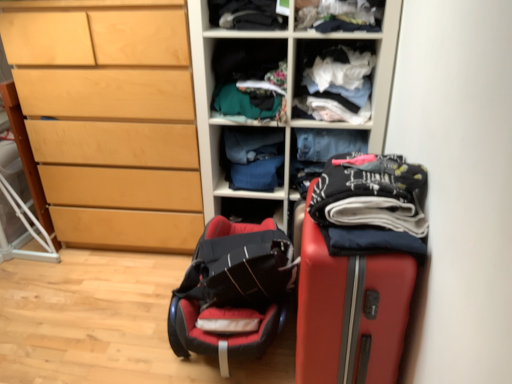
What do you see at coordinates (350, 312) in the screenshot? I see `rubberized red suitcase at right` at bounding box center [350, 312].

Where is `rubberized red suitcase at right`? The width and height of the screenshot is (512, 384). rubberized red suitcase at right is located at coordinates (350, 312).

Where is `printed cotton pants at right, the 5th clothing from the back`? Image resolution: width=512 pixels, height=384 pixels. printed cotton pants at right, the 5th clothing from the back is located at coordinates (369, 205).

Where is `wooden shelves at center`? The width and height of the screenshot is (512, 384). wooden shelves at center is located at coordinates (293, 89).

Identify the location of white cotton shirt at upper center, which is counted as the fourth clothing, starting from the back. (337, 15).

What do you see at coordinates (337, 81) in the screenshot? I see `white fabric at upper center, positioned as the first shelf in right-to-left order` at bounding box center [337, 81].

Identify the location of rubberized red suitcase at right. This screenshot has height=384, width=512. pos(350,312).

Is printed cotton pants at right, the 5th clothing from the back, positioned with its back to white fabric at upper center, positioned as the first shelf in right-to-left order?

No, white fabric at upper center, positioned as the first shelf in right-to-left order, is not at the back of printed cotton pants at right, the 5th clothing from the back.

Considering the relative positions of printed cotton pants at right, which appears as the 1th clothing when viewed from the front, and white fabric at upper center, which is the second shelf in left-to-right order, in the image provided, is printed cotton pants at right, which appears as the 1th clothing when viewed from the front, in front of white fabric at upper center, which is the second shelf in left-to-right order,?

Yes, it is in front of white fabric at upper center, which is the second shelf in left-to-right order.

Between printed cotton pants at right, which appears as the 1th clothing when viewed from the front, and white fabric at upper center, positioned as the first shelf in right-to-left order, which one has smaller width?

printed cotton pants at right, which appears as the 1th clothing when viewed from the front.

How many degrees apart are the facing directions of rubberized red suitcase at right and blue fabric at center, which appears as the 1th clothing when viewed from the back?

There is a 82.2-degree angle between the facing directions of rubberized red suitcase at right and blue fabric at center, which appears as the 1th clothing when viewed from the back.

Locate an element on the screen. The width and height of the screenshot is (512, 384). suitcase on the right of the blue fabric at center, arranged as the 5th clothing when viewed from the front is located at coordinates (350, 312).

Considering the sizes of objects rubberized red suitcase at right and blue fabric at center, arranged as the 5th clothing when viewed from the front, in the image provided, who is shorter, rubberized red suitcase at right or blue fabric at center, arranged as the 5th clothing when viewed from the front,?

blue fabric at center, arranged as the 5th clothing when viewed from the front.

Considering the relative sizes of white fabric at upper center, positioned as the first shelf in right-to-left order, and dark gray fabric at upper center, positioned as the 3th clothing in back-to-front order, in the image provided, is white fabric at upper center, positioned as the first shelf in right-to-left order, thinner than dark gray fabric at upper center, positioned as the 3th clothing in back-to-front order,?

No.

Is white fabric at upper center, which is the second shelf in left-to-right order, facing towards dark gray fabric at upper center, which is the 3th clothing in front-to-back order?

No, white fabric at upper center, which is the second shelf in left-to-right order, is not turned towards dark gray fabric at upper center, which is the 3th clothing in front-to-back order.

Based on their positions, is white fabric at upper center, positioned as the first shelf in right-to-left order, located to the left or right of dark gray fabric at upper center, positioned as the 3th clothing in back-to-front order?

Clearly, white fabric at upper center, positioned as the first shelf in right-to-left order, is on the right of dark gray fabric at upper center, positioned as the 3th clothing in back-to-front order, in the image.

Who is shorter, white fabric at upper center, positioned as the first shelf in right-to-left order, or dark gray fabric at upper center, positioned as the 3th clothing in back-to-front order?

Standing shorter between the two is dark gray fabric at upper center, positioned as the 3th clothing in back-to-front order.

Is light wood chest of drawers at left at the left side of white fabric at upper center, positioned as the first shelf in right-to-left order?

→ Yes.

At what (x,y) coordinates should I click in order to perform the action: click on chest of drawers below the white fabric at upper center, which is the second shelf in left-to-right order (from a real-world perspective). Please return your answer as a coordinate pair (x, y). The image size is (512, 384). Looking at the image, I should click on (109, 119).

Is light wood chest of drawers at left placed right next to white fabric at upper center, which is the second shelf in left-to-right order?

light wood chest of drawers at left is not next to white fabric at upper center, which is the second shelf in left-to-right order, and they're not touching.

Considering the sizes of light wood chest of drawers at left and white fabric at upper center, which is the second shelf in left-to-right order, in the image, is light wood chest of drawers at left wider or thinner than white fabric at upper center, which is the second shelf in left-to-right order,?

light wood chest of drawers at left is wider than white fabric at upper center, which is the second shelf in left-to-right order.

Can you confirm if wooden shelves at center is shorter than light wood chest of drawers at left?

No, wooden shelves at center is not shorter than light wood chest of drawers at left.

From the picture: Is wooden shelves at center positioned before light wood chest of drawers at left?

Yes, wooden shelves at center is closer to the camera.

You are a GUI agent. You are given a task and a screenshot of the screen. Output one action in this format:
    pyautogui.click(x=<x>, y=<y>)
    Task: Click on the chest of drawers behind the wooden shelves at center
    
    Given the screenshot: What is the action you would take?
    pyautogui.click(x=109, y=119)

Consider the image. How different are the orientations of rubberized red suitcase at right and soft leather suitcase at lower left in degrees?

0.000687 degrees.

How distant is rubberized red suitcase at right from soft leather suitcase at lower left?

rubberized red suitcase at right is 16.97 inches away from soft leather suitcase at lower left.

In terms of size, does rubberized red suitcase at right appear bigger or smaller than soft leather suitcase at lower left?

Clearly, rubberized red suitcase at right is larger in size than soft leather suitcase at lower left.

Is rubberized red suitcase at right facing away from soft leather suitcase at lower left?

No.

Locate an element on the screen. The image size is (512, 384). cupboard lying on the right of dark gray fabric at upper center, positioned as the 3th clothing in back-to-front order is located at coordinates (293, 89).

How many degrees apart are the facing directions of wooden shelves at center and dark gray fabric at upper center, which is the 3th clothing in front-to-back order?

The angular difference between wooden shelves at center and dark gray fabric at upper center, which is the 3th clothing in front-to-back order, is 5.65 degrees.

Which is closer to the camera, (369, 143) or (278, 29)?

The point (278, 29) is closer to the camera.

This screenshot has width=512, height=384. Find the location of `shelf that is the 1st one when counting upward from the printed cotton pants at right, which appears as the 1th clothing when viewed from the front (from the image's perspective)`. shelf that is the 1st one when counting upward from the printed cotton pants at right, which appears as the 1th clothing when viewed from the front (from the image's perspective) is located at coordinates (337, 81).

You are a GUI agent. You are given a task and a screenshot of the screen. Output one action in this format:
    pyautogui.click(x=<x>, y=<y>)
    Task: Click on the suitcase that is under the blue fabric at center, which appears as the 1th clothing when viewed from the back (from a real-world perspective)
    The image size is (512, 384).
    Given the screenshot: What is the action you would take?
    pyautogui.click(x=350, y=312)

Estimate the real-world distances between objects in this image. Which object is further from white cotton shirt at upper center, which is counted as the fourth clothing, starting from the back, light wood chest of drawers at left or wooden shelves at center?

light wood chest of drawers at left lies further to white cotton shirt at upper center, which is counted as the fourth clothing, starting from the back, than the other object.

From the image, which object appears to be farther from wooden shelves at center, printed cotton pants at right, the 5th clothing from the back, or white fabric at upper center, positioned as the first shelf in right-to-left order?

Based on the image, printed cotton pants at right, the 5th clothing from the back, appears to be further to wooden shelves at center.

Which object lies further to the anchor point dark gray fabric at upper center, which is the 3th clothing in front-to-back order, white fabric at upper center, positioned as the first shelf in right-to-left order, or blue fabric at center, arranged as the 5th clothing when viewed from the front?

Based on the image, blue fabric at center, arranged as the 5th clothing when viewed from the front, appears to be further to dark gray fabric at upper center, which is the 3th clothing in front-to-back order.

Which object lies nearer to the anchor point dark blue cotton pants at center, which is counted as the 4th clothing, starting from the front, light wood chest of drawers at left or blue fabric at center, which appears as the 1th clothing when viewed from the back?

blue fabric at center, which appears as the 1th clothing when viewed from the back.

Which object lies nearer to the anchor point textured fabric clothes at center, which appears as the first shelf when viewed from the left, rubberized red suitcase at right or blue fabric at center, which appears as the 1th clothing when viewed from the back?

blue fabric at center, which appears as the 1th clothing when viewed from the back, is closer to textured fabric clothes at center, which appears as the first shelf when viewed from the left.

Considering their positions, is textured fabric clothes at center, which appears as the first shelf when viewed from the left, positioned further to printed cotton pants at right, which appears as the 1th clothing when viewed from the front, than white cotton shirt at upper center, the second clothing when ordered from front to back?

Among the two, textured fabric clothes at center, which appears as the first shelf when viewed from the left, is located further to printed cotton pants at right, which appears as the 1th clothing when viewed from the front.

Considering their positions, is white fabric at upper center, positioned as the first shelf in right-to-left order, positioned further to light wood chest of drawers at left than printed cotton pants at right, which appears as the 1th clothing when viewed from the front?

printed cotton pants at right, which appears as the 1th clothing when viewed from the front, is further to light wood chest of drawers at left.

Based on their spatial positions, is white fabric at upper center, positioned as the first shelf in right-to-left order, or textured fabric clothes at center, which appears as the first shelf when viewed from the left, closer to rubberized red suitcase at right?

The object closer to rubberized red suitcase at right is white fabric at upper center, positioned as the first shelf in right-to-left order.

Locate an element on the screen. cupboard between dark gray fabric at upper center, which is the 3th clothing in front-to-back order, and dark blue cotton pants at center, the second clothing when ordered from back to front, in the up-down direction is located at coordinates (293, 89).

This screenshot has width=512, height=384. I want to click on shelf situated between light wood chest of drawers at left and printed cotton pants at right, the 5th clothing from the back, from left to right, so click(x=248, y=78).

Find the location of a particular element. This screenshot has width=512, height=384. suitcase located between light wood chest of drawers at left and dark blue cotton pants at center, the second clothing when ordered from back to front, in the left-right direction is located at coordinates (350, 312).

Identify the location of clothing situated between light wood chest of drawers at left and dark gray fabric at upper center, which is the 3th clothing in front-to-back order, from left to right. (253, 157).